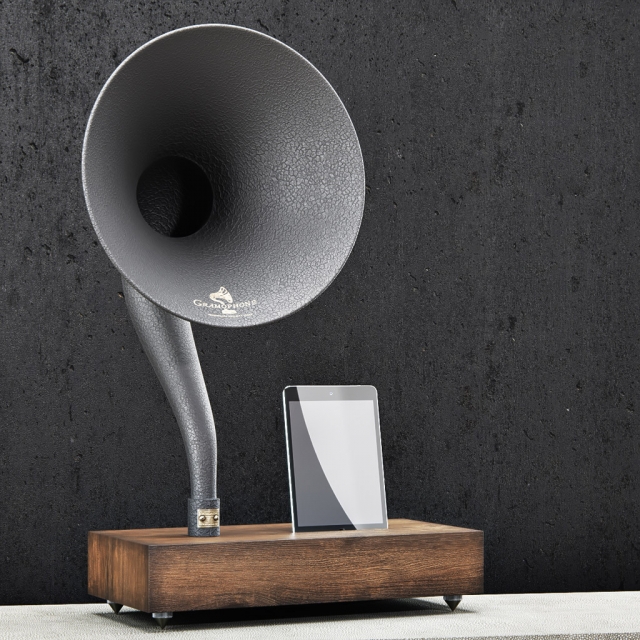
At what (x,y) coordinates should I click in order to perform the action: click on white brand inside speaker. Please return your answer as a coordinate pair (x, y). The image size is (640, 640). Looking at the image, I should click on (221, 306).